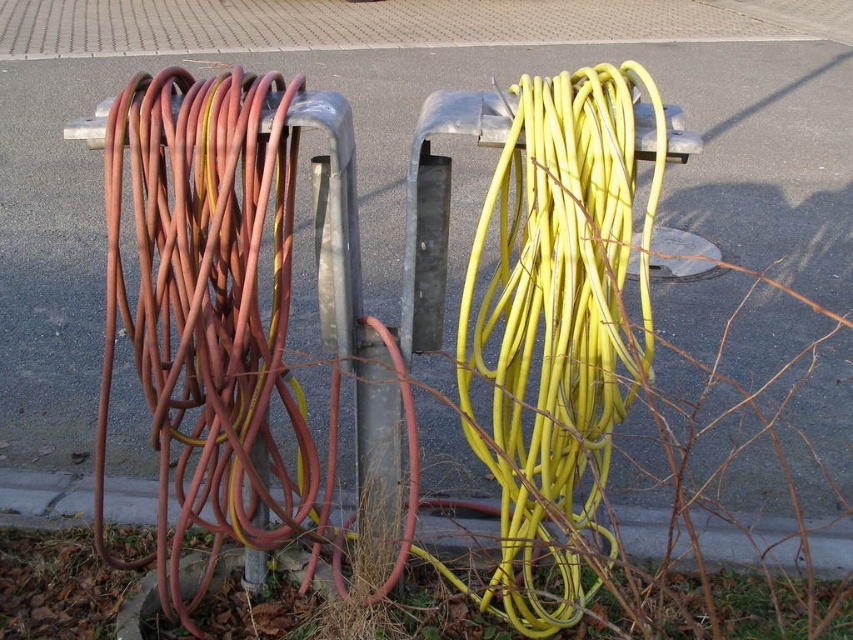
Is matte red hose at left positioned before gray concrete curb at lower center?

Yes, it is.

This screenshot has width=853, height=640. Describe the element at coordinates (202, 305) in the screenshot. I see `matte red hose at left` at that location.

The height and width of the screenshot is (640, 853). Identify the location of matte red hose at left. (202, 305).

Is point (595, 221) positioned in front of point (26, 518)?

Yes, point (595, 221) is in front of point (26, 518).

Find the location of a particular element. The height and width of the screenshot is (640, 853). yellow rubber hose at center is located at coordinates (558, 321).

This screenshot has width=853, height=640. Identify the location of yellow rubber hose at center. (558, 321).

Does matte red hose at left appear over yellow rubber hose at center?

No, matte red hose at left is not above yellow rubber hose at center.

Is matte red hose at left closer to the viewer compared to yellow rubber hose at center?

No.

Is point (157, 493) closer to camera compared to point (560, 488)?

No, (157, 493) is behind (560, 488).

Where is `matte red hose at left`? The height and width of the screenshot is (640, 853). matte red hose at left is located at coordinates (202, 305).